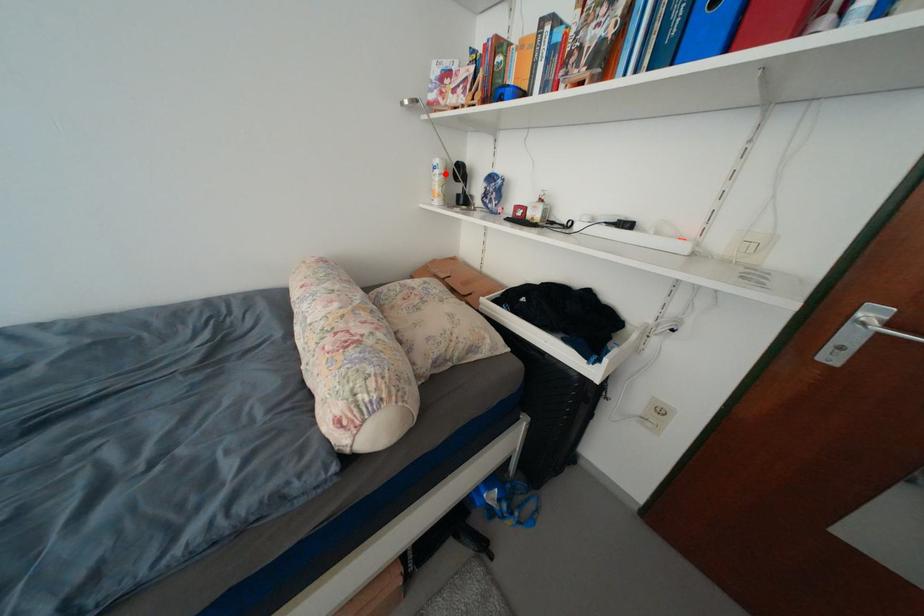
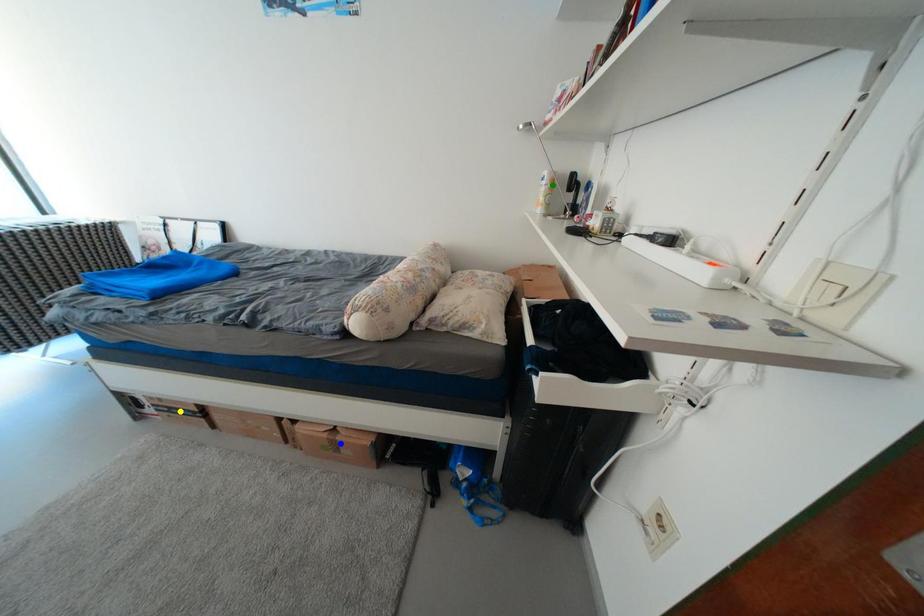
Question: I am providing you with two images of the same scene from different viewpoints. A red point is marked on the first image. You are given multiple points on the second image. In image 2, which mark is for the same physical point as the one in image 1?

Choices:
 (A) blue point
 (B) yellow point
 (C) green point

Answer: (C)